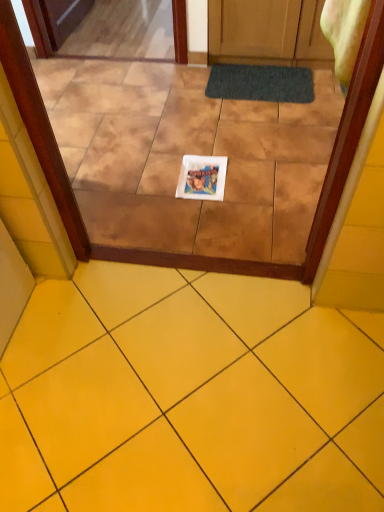
The width and height of the screenshot is (384, 512). I want to click on vacant area located to the right-hand side of white paper at center, so click(252, 177).